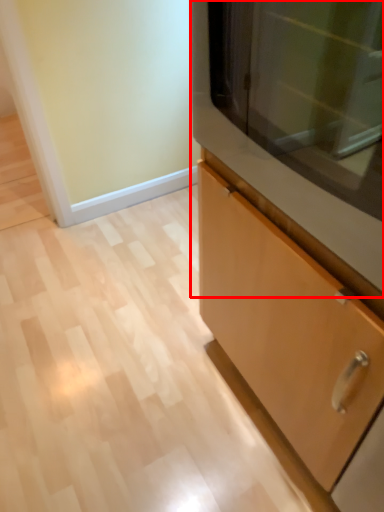
Question: From the image's perspective, where is microwave (annotated by the red box) located relative to cabinetry?

Choices:
 (A) below
 (B) above

Answer: (B)